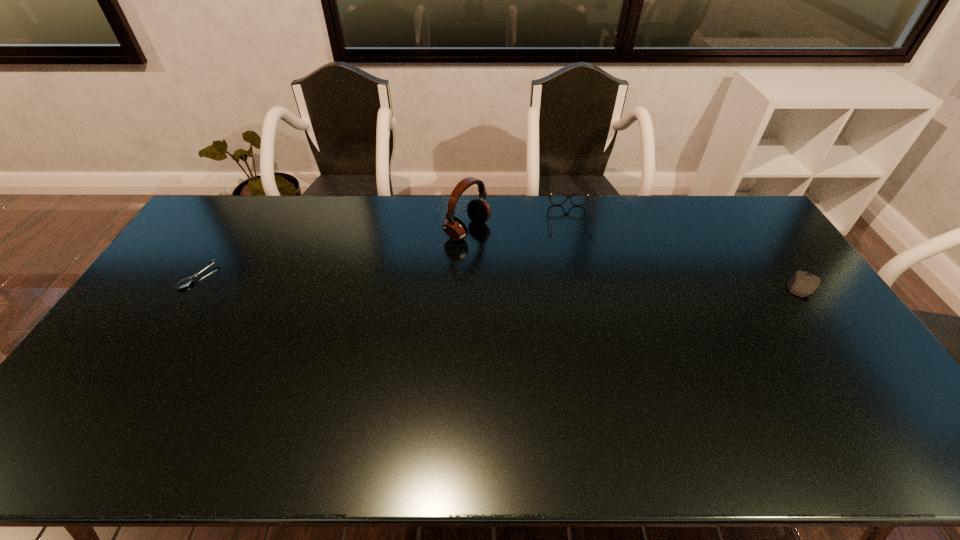
Find the location of a particular element. vacant region located 0.100m on the ear pads of the headset is located at coordinates (510, 252).

Locate an element on the screen. This screenshot has width=960, height=540. free location located 0.380m on the ear pads of the headset is located at coordinates click(582, 289).

The image size is (960, 540). I want to click on blank space located on the ear pads of the headset, so click(532, 264).

Find the location of a particular element. The width and height of the screenshot is (960, 540). vacant region located 0.260m with the lenses facing outward on the spectacles is located at coordinates (580, 289).

This screenshot has width=960, height=540. Identify the location of vacant space located 0.090m with the lenses facing outward on the spectacles. (574, 253).

You are a GUI agent. You are given a task and a screenshot of the screen. Output one action in this format:
    pyautogui.click(x=<x>, y=<y>)
    Task: Click on the vacant space located 0.110m with the lenses facing outward on the spectacles
    
    Given the screenshot: What is the action you would take?
    pyautogui.click(x=575, y=257)

Where is `headset that is at the far edge`? headset that is at the far edge is located at coordinates (478, 210).

Locate an element on the screen. Image resolution: width=960 pixels, height=540 pixels. spectacles present at the far edge is located at coordinates (568, 196).

Identify the location of object that is at the left edge. The width and height of the screenshot is (960, 540). (186, 282).

I want to click on object located at the right edge, so click(802, 284).